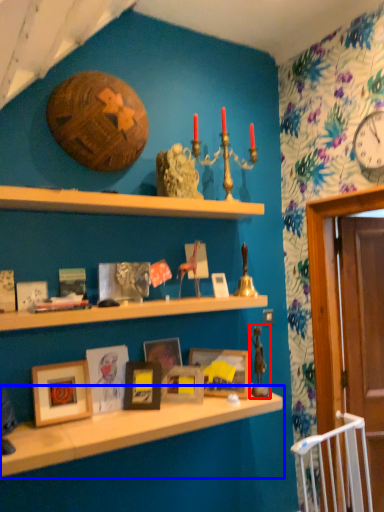
Question: Which object appears closest to the camera in this image, toy (highlighted by a red box) or shelf (highlighted by a blue box)?

Choices:
 (A) toy
 (B) shelf

Answer: (B)